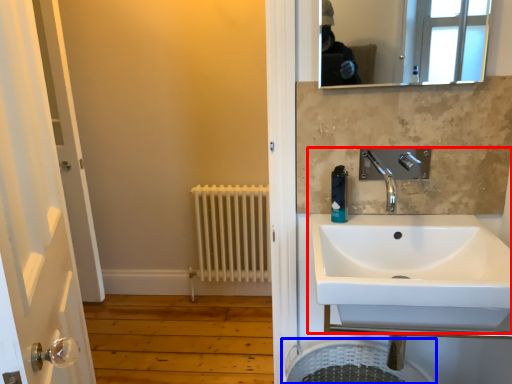
Question: Which object is closer to the camera taking this photo, sink (highlighted by a red box) or laundry basket (highlighted by a blue box)?

Choices:
 (A) sink
 (B) laundry basket

Answer: (A)